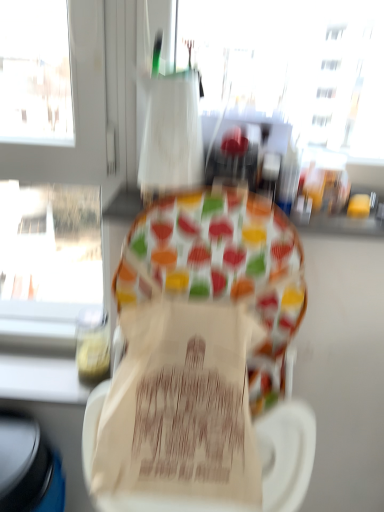
You are a GUI agent. You are given a task and a screenshot of the screen. Output one action in this format:
    pyautogui.click(x=<x>, y=<y>)
    Task: Click on the vacant space situated above matte glass window sill at lower left (from a real-world perspective)
    
    Given the screenshot: What is the action you would take?
    pyautogui.click(x=48, y=371)